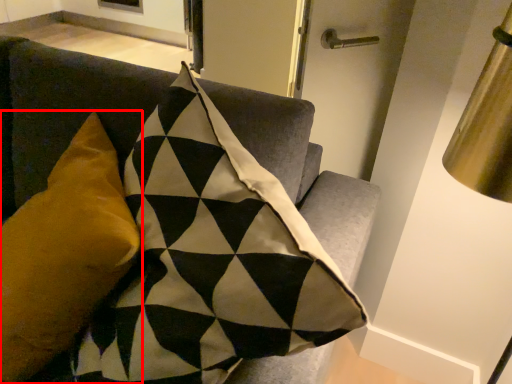
Question: From the image, what is the correct spatial relationship of pillow (annotated by the red box) in relation to furniture?

Choices:
 (A) right
 (B) left

Answer: (A)